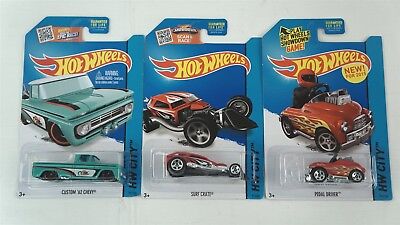
Locate an element on the screen. 3 toy cars is located at coordinates (79, 170), (192, 166), (330, 167).